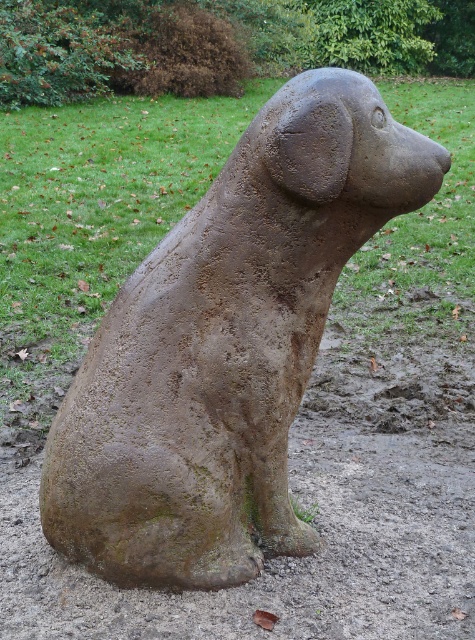
Question: From the image, what is the correct spatial relationship of rusty stone dog at center in relation to brown textured dog at center?

Choices:
 (A) below
 (B) above

Answer: (B)

Question: Among these points, which one is farthest from the camera?

Choices:
 (A) (380, 108)
 (B) (434, 356)

Answer: (B)

Question: Is the position of rusty stone dog at center less distant than that of brown textured dog at center?

Choices:
 (A) yes
 (B) no

Answer: (A)

Question: Which object is closer to the camera taking this photo?

Choices:
 (A) rusty stone dog at center
 (B) brown textured dog at center

Answer: (A)

Question: Does rusty stone dog at center appear under brown textured dog at center?

Choices:
 (A) no
 (B) yes

Answer: (A)